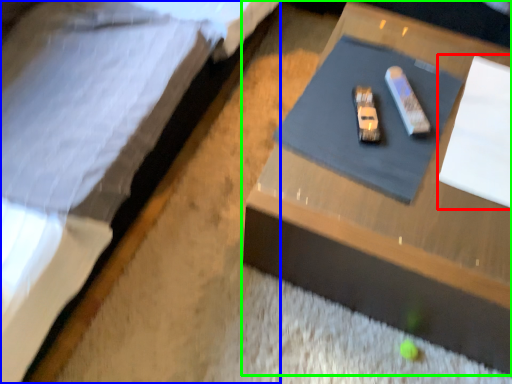
Question: Which object is the farthest from notepad (highlighted by a red box)? Choose among these: bed (highlighted by a blue box) or table (highlighted by a green box).

Choices:
 (A) bed
 (B) table

Answer: (A)